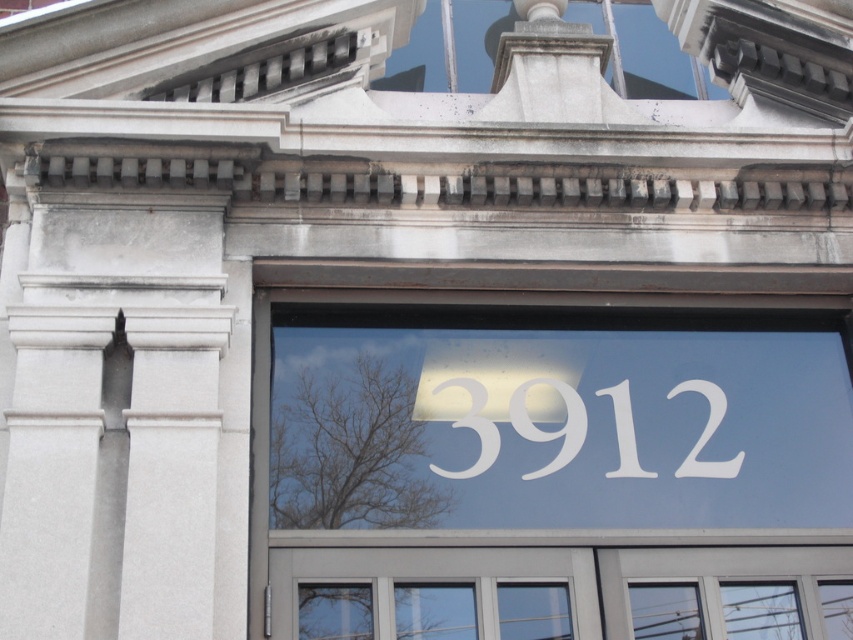
Between point (566, 460) and point (729, 467), which one is positioned behind?

Point (729, 467)

Can you confirm if white vinyl numbers at center is taller than white matte number at center?

Yes, white vinyl numbers at center is taller than white matte number at center.

Locate an element on the screen. The image size is (853, 640). white vinyl numbers at center is located at coordinates (544, 468).

What are the coordinates of `white vinyl numbers at center` in the screenshot? It's located at (544, 468).